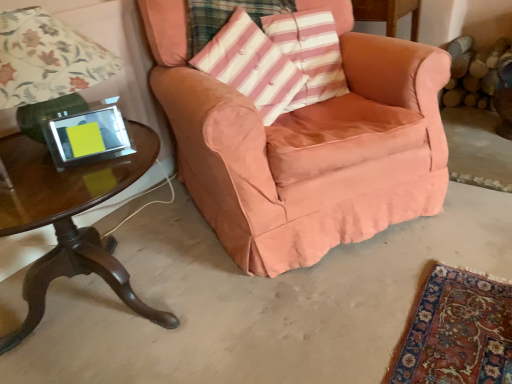
Question: Is matte green lamp at left located outside pink striped fabric pillow at center?

Choices:
 (A) yes
 (B) no

Answer: (A)

Question: Is matte green lamp at left closer to camera compared to pink striped fabric pillow at center?

Choices:
 (A) yes
 (B) no

Answer: (A)

Question: Can you confirm if matte green lamp at left is smaller than pink striped fabric pillow at center?

Choices:
 (A) no
 (B) yes

Answer: (A)

Question: From a real-world perspective, is matte green lamp at left beneath pink striped fabric pillow at center?

Choices:
 (A) no
 (B) yes

Answer: (A)

Question: Is pink striped fabric pillow at center completely or partially inside matte green lamp at left?

Choices:
 (A) yes
 (B) no

Answer: (B)

Question: From the image's perspective, is matte green lamp at left below pink striped fabric pillow at center?

Choices:
 (A) yes
 (B) no

Answer: (A)

Question: From a real-world perspective, is shiny dark wood table at lower left physically above pink striped fabric pillow at center?

Choices:
 (A) yes
 (B) no

Answer: (B)

Question: Can you confirm if shiny dark wood table at lower left is thinner than pink striped fabric pillow at center?

Choices:
 (A) no
 (B) yes

Answer: (A)

Question: Could pink striped fabric pillow at center be considered to be inside shiny dark wood table at lower left?

Choices:
 (A) yes
 (B) no

Answer: (B)

Question: Is shiny dark wood table at lower left to the left of pink striped fabric pillow at center from the viewer's perspective?

Choices:
 (A) no
 (B) yes

Answer: (B)

Question: Is there a large distance between shiny dark wood table at lower left and pink striped fabric pillow at center?

Choices:
 (A) yes
 (B) no

Answer: (B)

Question: Considering the relative sizes of shiny dark wood table at lower left and pink striped fabric pillow at center in the image provided, is shiny dark wood table at lower left bigger than pink striped fabric pillow at center?

Choices:
 (A) yes
 (B) no

Answer: (A)

Question: Does shiny dark wood table at lower left have a smaller size compared to suede-like peach armchair at center?

Choices:
 (A) no
 (B) yes

Answer: (B)